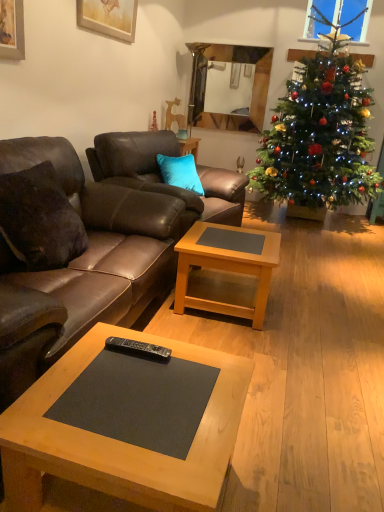
Question: Looking at the image, does brown leather couch at left, which is counted as the 2th studio couch, starting from the back, seem bigger or smaller compared to green matte christmas tree at right?

Choices:
 (A) big
 (B) small

Answer: (B)

Question: Considering the positions of point (89, 300) and point (294, 76), is point (89, 300) closer or farther from the camera than point (294, 76)?

Choices:
 (A) closer
 (B) farther

Answer: (A)

Question: Considering the real-world distances, which object is farthest from the wooden picture frame at upper center?

Choices:
 (A) brown leather couch at left, which is counted as the 2th studio couch, starting from the back
 (B) black plastic remote control at center
 (C) light brown wooden coffee table at center, which is the first coffee table from back to front
 (D) wooden matte coffee table at center, acting as the second coffee table starting from the back
 (E) brown leather couch at center, the 1th studio couch when ordered from back to front

Answer: (D)

Question: Which of these objects is positioned closest to the wooden matte coffee table at center, placed as the 1th coffee table when sorted from front to back?

Choices:
 (A) glossy wood mirror at upper center
 (B) brown leather couch at center, positioned as the 2th studio couch in front-to-back order
 (C) dark brown leather pillow at left
 (D) wooden picture frame at upper center
 (E) black plastic remote control at center

Answer: (E)